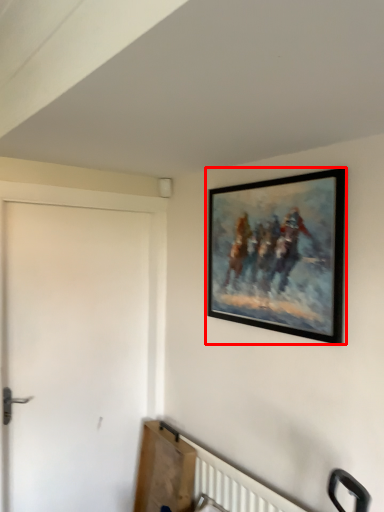
Question: In this image, where is picture frame (annotated by the red box) located relative to door?

Choices:
 (A) right
 (B) left

Answer: (A)